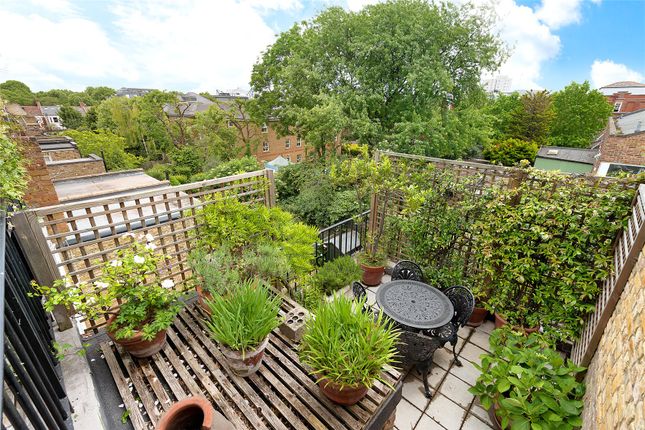
Find the location of a particular element. The image size is (645, 430). tile flooring is located at coordinates (444, 390).